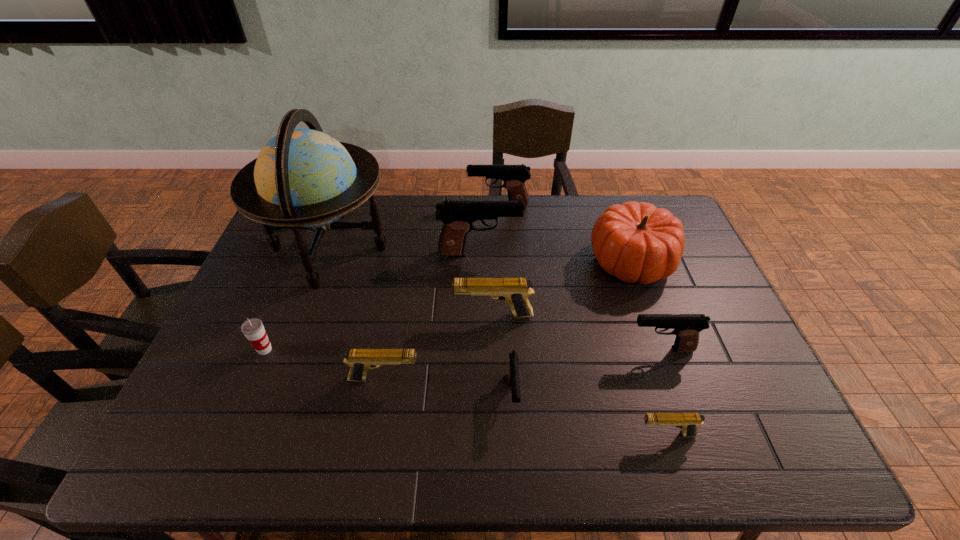
You are a GUI agent. You are given a task and a screenshot of the screen. Output one action in this format:
    pyautogui.click(x=<x>, y=<y>)
    Task: Click on the pistol positioned at the right edge
    Image resolution: width=960 pixels, height=540 pixels.
    Given the screenshot: What is the action you would take?
    pyautogui.click(x=687, y=327)

Find the location of a particular element. This screenshot has width=960, height=540. object located in the far left corner section of the desktop is located at coordinates (303, 178).

This screenshot has height=540, width=960. In order to click on object that is at the far right corner in this screenshot , I will do `click(636, 242)`.

In order to click on vacant point at the far edge in this screenshot , I will do `click(432, 197)`.

Find the location of a particular element. The height and width of the screenshot is (540, 960). vacant space at the near edge of the desktop is located at coordinates (343, 440).

At what (x,y) coordinates should I click in order to perform the action: click on vacant space at the right edge of the desktop. Please return your answer as a coordinate pair (x, y). Image resolution: width=960 pixels, height=540 pixels. Looking at the image, I should click on (692, 286).

I want to click on vacant space at the near left corner of the desktop, so click(176, 441).

Image resolution: width=960 pixels, height=540 pixels. Find the location of `vacant space at the far right corner of the desktop`. vacant space at the far right corner of the desktop is located at coordinates (668, 200).

You are a GUI agent. You are given a task and a screenshot of the screen. Output one action in this format:
    pyautogui.click(x=<x>, y=<y>)
    Task: Click on the vacant area between the smallest black pistol and the tallest object
    This screenshot has height=540, width=960.
    Given the screenshot: What is the action you would take?
    pyautogui.click(x=421, y=322)

Image resolution: width=960 pixels, height=540 pixels. Find the location of `vacant space that's between the smallest black pistol and the second tan pistol from right to left`. vacant space that's between the smallest black pistol and the second tan pistol from right to left is located at coordinates (503, 355).